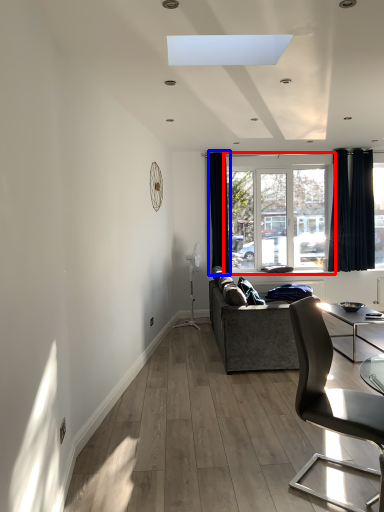
Question: Among these objects, which one is nearest to the camera, window (highlighted by a red box) or curtain (highlighted by a blue box)?

Choices:
 (A) window
 (B) curtain

Answer: (B)